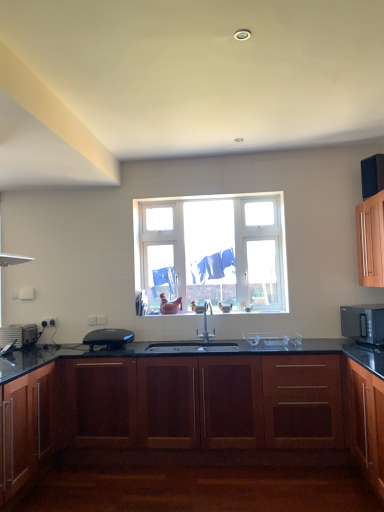
Where is `free space in front of silver metallic faucet at center`? free space in front of silver metallic faucet at center is located at coordinates (208, 350).